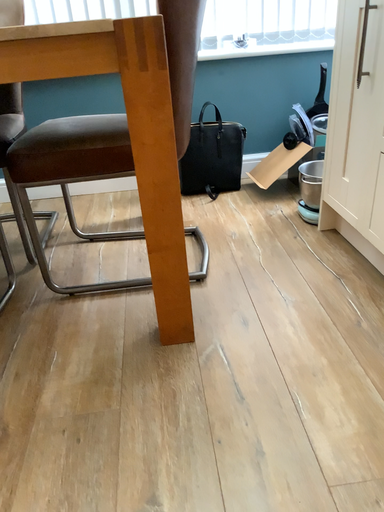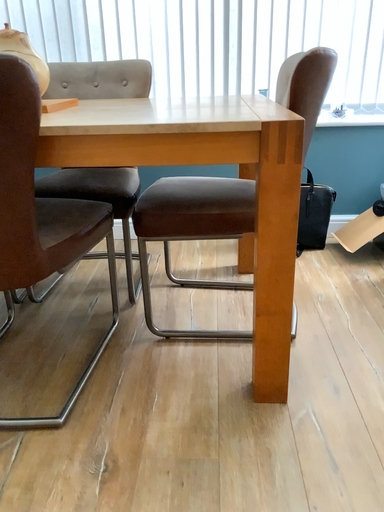
Question: How did the camera likely rotate when shooting the video?

Choices:
 (A) rotated right
 (B) rotated left

Answer: (B)